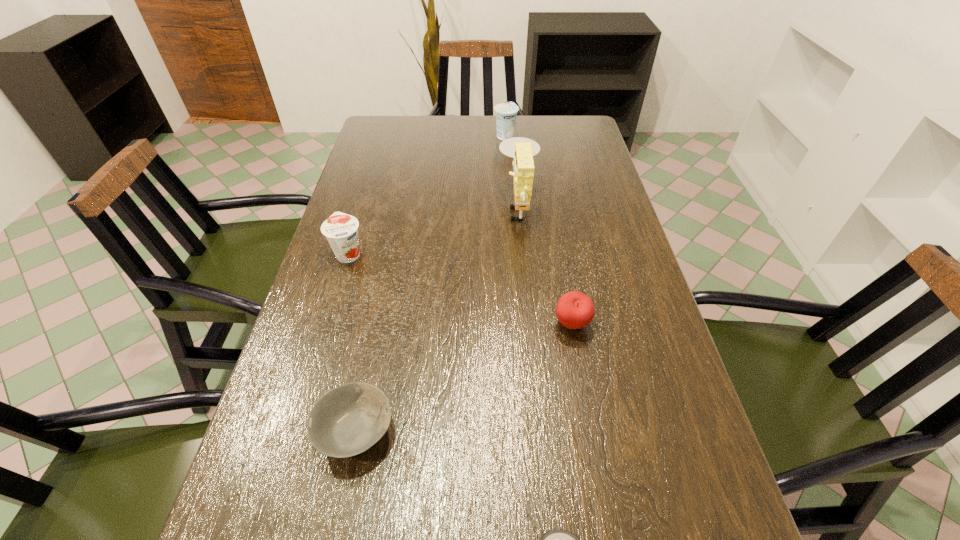
Locate an element on the screen. The height and width of the screenshot is (540, 960). sponge is located at coordinates (521, 149).

Find the location of a particular element. the tallest object is located at coordinates (521, 149).

Where is `the farthest object`? The width and height of the screenshot is (960, 540). the farthest object is located at coordinates (506, 113).

This screenshot has width=960, height=540. Find the location of `the leftmost yogurt`. the leftmost yogurt is located at coordinates (341, 230).

Where is `the third farthest object`? the third farthest object is located at coordinates (341, 230).

At what (x,y) coordinates should I click in order to perform the action: click on the fourth farthest object. Please return your answer as a coordinate pair (x, y). This screenshot has width=960, height=540. Looking at the image, I should click on (574, 310).

Find the location of a particular element. This screenshot has height=540, width=960. the fifth farthest object is located at coordinates (349, 419).

At what (x,y) coordinates should I click in order to perform the action: click on bowl. Please return your answer as a coordinate pair (x, y). This screenshot has width=960, height=540. Looking at the image, I should click on (349, 419).

This screenshot has width=960, height=540. In order to click on free location located on the front-facing side of the second farthest object in this screenshot , I will do `click(374, 205)`.

The image size is (960, 540). I want to click on vacant space located 0.150m on the front-facing side of the second farthest object, so click(x=447, y=205).